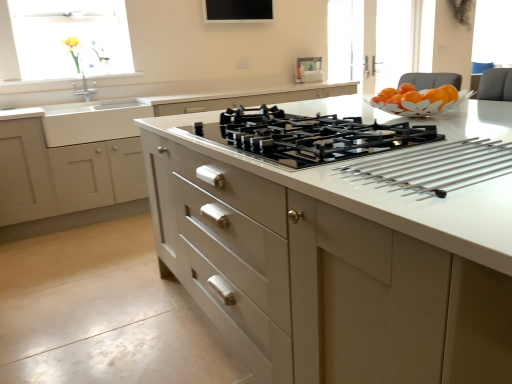
At what (x,y) coordinates should I click in order to perform the action: click on vacant space in yellow matte flower at upper left (from a real-world perspective). Please return your answer as a coordinate pair (x, y). Looking at the image, I should click on (73, 76).